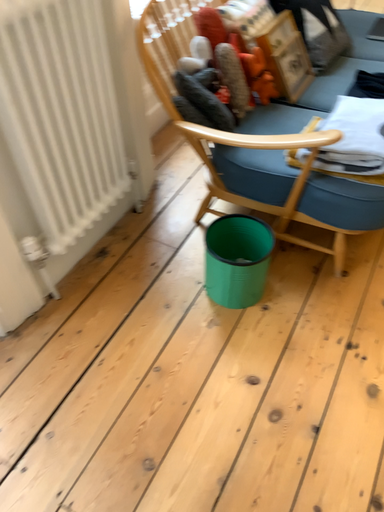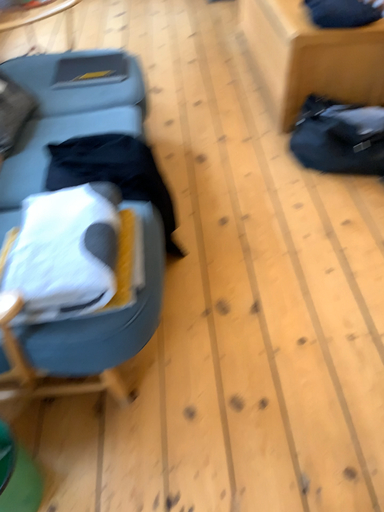
Question: Which way did the camera rotate in the video?

Choices:
 (A) rotated right
 (B) rotated left

Answer: (A)